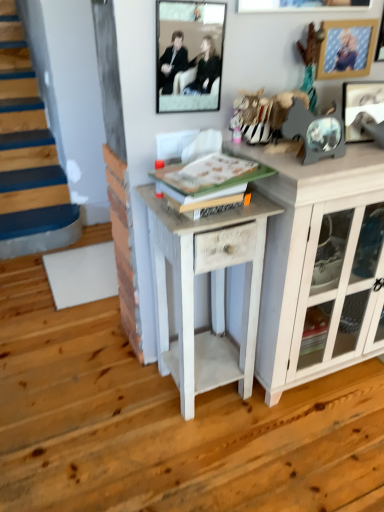
Question: Is metallic silver picture frame at upper right, the 3th picture frame when ordered from left to right, in front of or behind white painted wood side table at center in the image?

Choices:
 (A) front
 (B) behind

Answer: (B)

Question: Is metallic silver picture frame at upper right, the 3th picture frame when ordered from left to right, wider or thinner than white painted wood side table at center?

Choices:
 (A) wide
 (B) thin

Answer: (B)

Question: Estimate the real-world distances between objects in this image. Which object is closer to the white painted wood side table at center?

Choices:
 (A) matte black frame at upper center, which ranks as the 3th picture frame in right-to-left order
 (B) white wood cabinet at right
 (C) wooden picture frame at upper right, the second picture frame when ordered from right to left
 (D) metallic silver picture frame at upper right, the 3th picture frame when ordered from left to right

Answer: (B)

Question: Which object is positioned farthest from the matte black frame at upper center, which ranks as the 3th picture frame in right-to-left order?

Choices:
 (A) wooden picture frame at upper right, the second picture frame when ordered from right to left
 (B) white painted wood side table at center
 (C) white wood cabinet at right
 (D) metallic silver picture frame at upper right, positioned as the 1th picture frame in right-to-left order

Answer: (C)